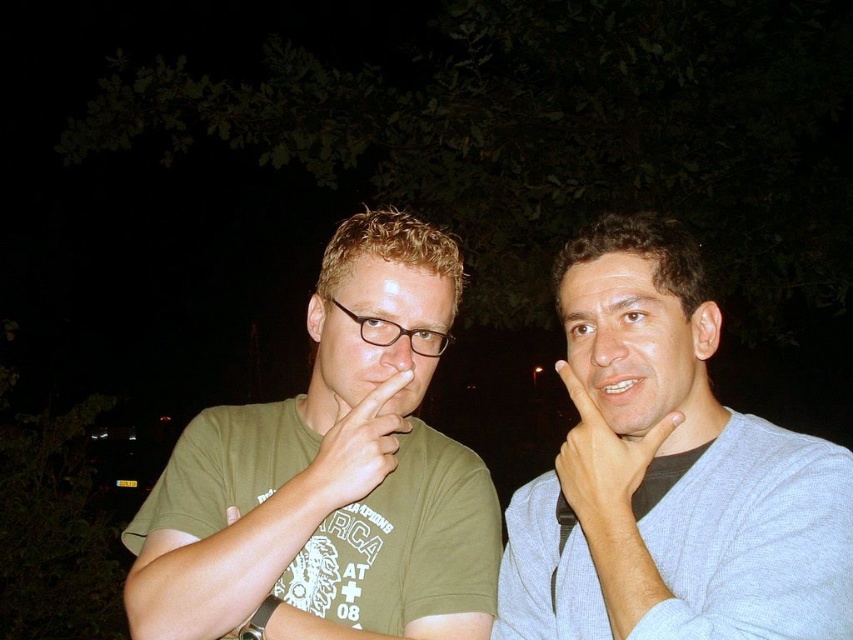
Question: Is gray sweater at right to the right of matte green t-shirt at center from the viewer's perspective?

Choices:
 (A) yes
 (B) no

Answer: (A)

Question: Which point is closer to the camera?

Choices:
 (A) green matte t-shirt at left
 (B) gray sweater at right

Answer: (B)

Question: Does green matte t-shirt at left have a smaller size compared to matte green t-shirt at center?

Choices:
 (A) no
 (B) yes

Answer: (A)

Question: Which object is closer to the camera taking this photo?

Choices:
 (A) gray sweater at right
 (B) matte green t-shirt at center
 (C) green matte t-shirt at left

Answer: (A)

Question: Does gray sweater at right have a greater width compared to matte green t-shirt at center?

Choices:
 (A) yes
 (B) no

Answer: (A)

Question: Which object is closer to the camera taking this photo?

Choices:
 (A) skinny white hand at right
 (B) matte green t-shirt at center
 (C) gray sweater at right

Answer: (C)